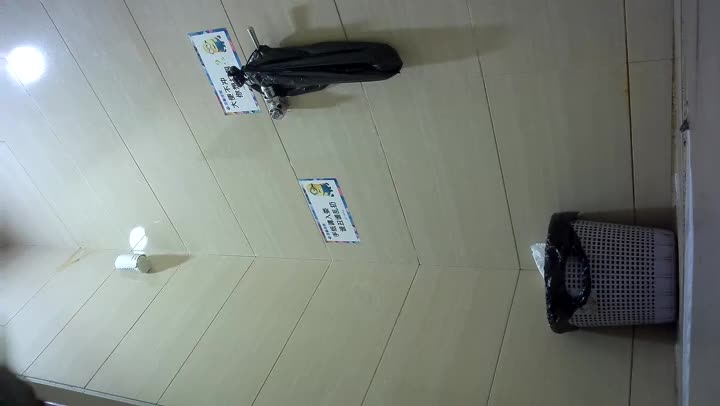
What are the coordinates of `floor` in the screenshot? It's located at (698, 272).